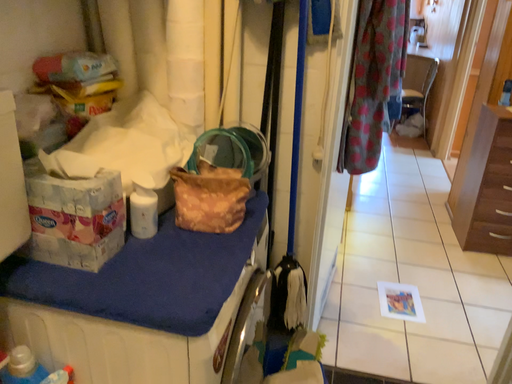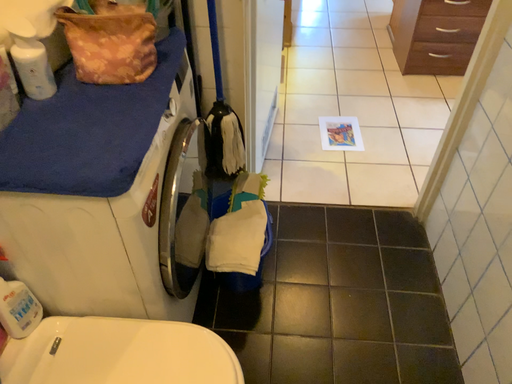
Question: How did the camera likely rotate when shooting the video?

Choices:
 (A) rotated left
 (B) rotated right

Answer: (B)